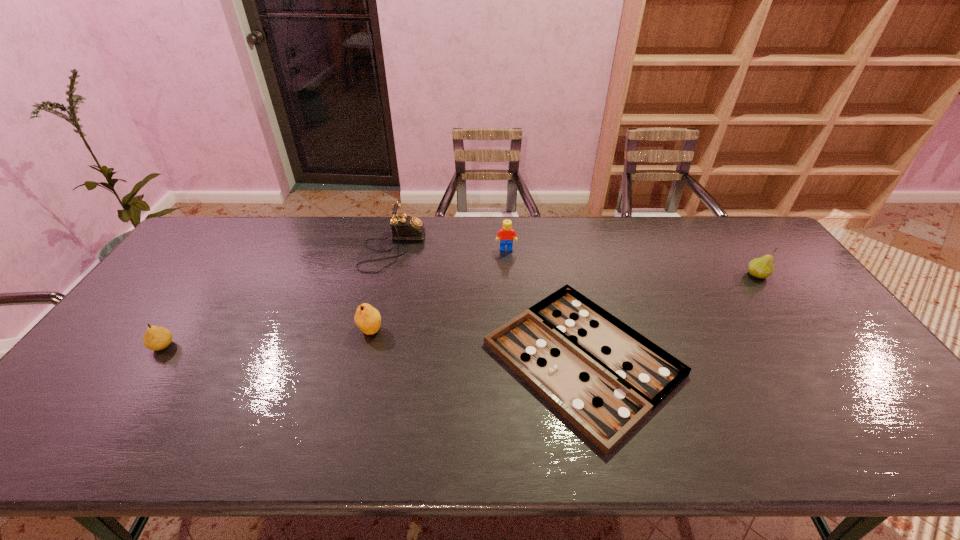
Image resolution: width=960 pixels, height=540 pixels. Identify the location of free point located on the back of the second pear from left to right. (380, 289).

At what (x,y) coordinates should I click in order to perform the action: click on vacant space located on the back of the leftmost pear. Please return your answer as a coordinate pair (x, y). The height and width of the screenshot is (540, 960). Looking at the image, I should click on (180, 321).

This screenshot has height=540, width=960. What are the coordinates of `vacant space located 0.310m on the right of the shortest object` in the screenshot? It's located at tap(801, 359).

Where is `telephone that is at the far edge`? telephone that is at the far edge is located at coordinates (404, 227).

The height and width of the screenshot is (540, 960). In order to click on Lego that is at the far edge in this screenshot , I will do `click(506, 234)`.

Where is `object located in the near edge section of the desktop`? Image resolution: width=960 pixels, height=540 pixels. object located in the near edge section of the desktop is located at coordinates (604, 377).

Locate an element on the screen. The image size is (960, 540). object that is at the left edge is located at coordinates (156, 338).

The image size is (960, 540). Find the location of `object present at the right edge`. object present at the right edge is located at coordinates (763, 267).

Locate an element on the screen. This screenshot has width=960, height=540. free region at the far edge of the desktop is located at coordinates 329,228.

This screenshot has width=960, height=540. What are the coordinates of `free region at the near edge of the desktop` in the screenshot? It's located at (211, 436).